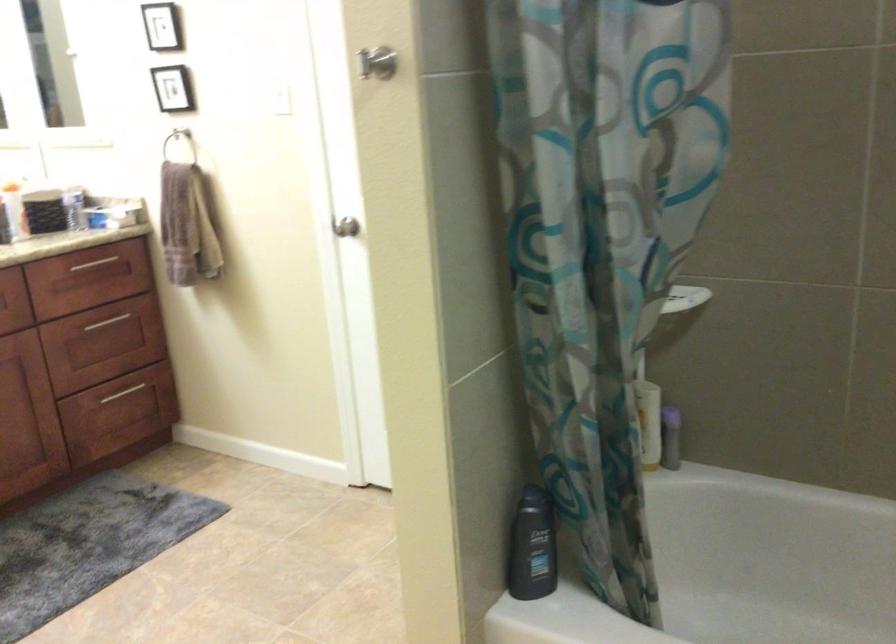
Which object does [177,138] point to?

It refers to a metal towel ring.